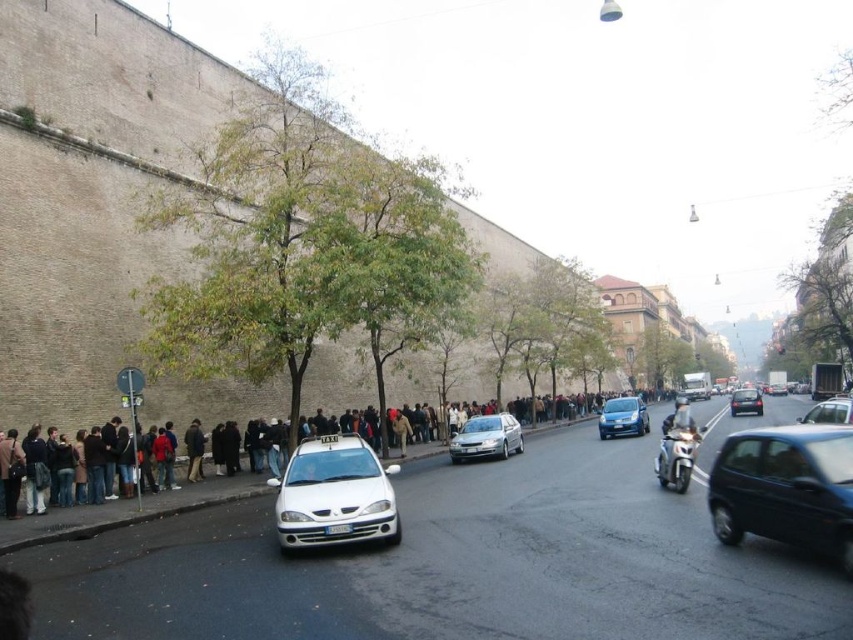
Between shiny black car at center and metallic silver sedan at right, which one has more height?

metallic silver sedan at right

Between shiny black car at center and metallic silver sedan at right, which one appears on the right side from the viewer's perspective?

From the viewer's perspective, metallic silver sedan at right appears more on the right side.

Where is `shiny black car at center`? shiny black car at center is located at coordinates (785, 488).

Where is `shiny black car at center`? This screenshot has width=853, height=640. shiny black car at center is located at coordinates click(785, 488).

Which of these two, metallic silver sedan at right or shiny black sedan at center, stands shorter?

Standing shorter between the two is shiny black sedan at center.

Who is positioned more to the left, metallic silver sedan at right or shiny black sedan at center?

metallic silver sedan at right

Is point (844, 416) in front of point (743, 403)?

Yes.

The height and width of the screenshot is (640, 853). Find the location of `metallic silver sedan at right`. metallic silver sedan at right is located at coordinates (828, 412).

Is dark gray fabric crowd at left to the left of metallic silver sedan at right from the viewer's perspective?

Correct, you'll find dark gray fabric crowd at left to the left of metallic silver sedan at right.

Is point (155, 506) positioned in front of point (838, 406)?

That is True.

Describe the element at coordinates (535, 460) in the screenshot. I see `dark gray fabric crowd at left` at that location.

You are a GUI agent. You are given a task and a screenshot of the screen. Output one action in this format:
    pyautogui.click(x=<x>, y=<y>)
    Task: Click on the dark gray fabric crowd at left
    
    Given the screenshot: What is the action you would take?
    pyautogui.click(x=535, y=460)